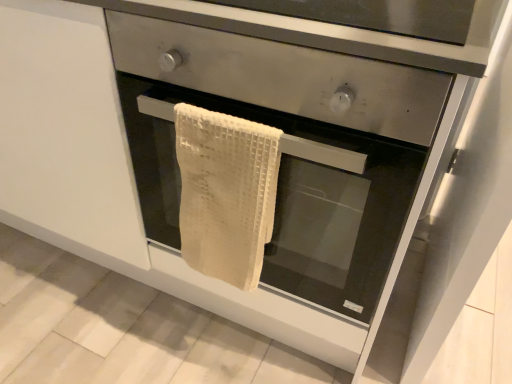
Question: Is white waffle towel at center situated inside white woven towel at center or outside?

Choices:
 (A) inside
 (B) outside

Answer: (B)

Question: From their relative heights in the image, would you say white waffle towel at center is taller or shorter than white woven towel at center?

Choices:
 (A) tall
 (B) short

Answer: (B)

Question: Which object is positioned farthest from the beige woven towel at center?

Choices:
 (A) white waffle towel at center
 (B) white woven towel at center

Answer: (A)

Question: Which is nearer to the beige woven towel at center?

Choices:
 (A) white woven towel at center
 (B) white waffle towel at center

Answer: (A)